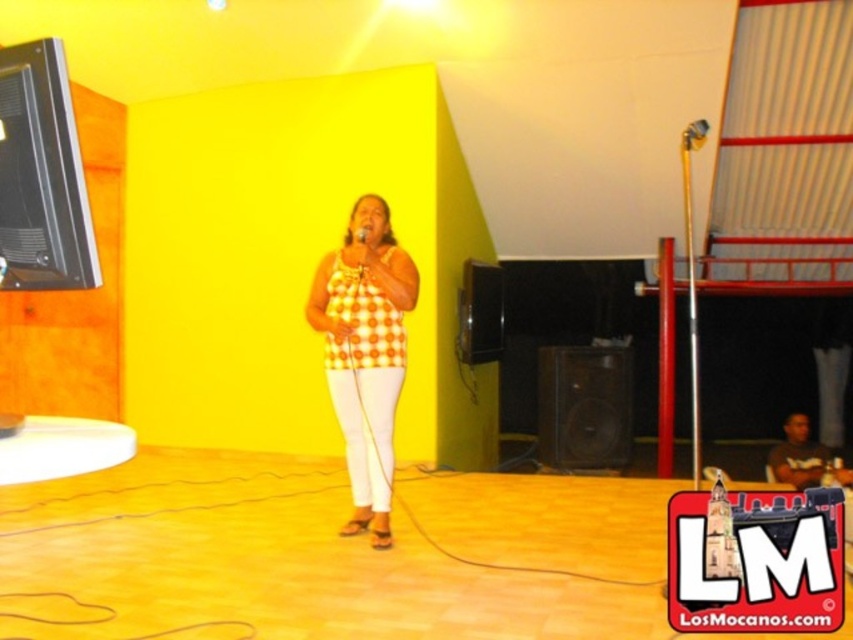
You are standing on the stage and want to move from the point at coordinates (358, 396) to the point at (370, 228). Can you walk directly towards the second point without going around?

Point (358, 396) is behind point (370, 228), so you cannot walk directly towards the second point without going around because you would have to move forward past the first point to reach the second.

You are a stagehand setting up for a performance. You need to place a new speaker to the right of the metallic shiny microphone at center. Based on the current setup, where should you position the speaker relative to the yellow checkered tank top at center?

The yellow checkered tank top at center is to the left of the metallic shiny microphone at center. Therefore, placing the speaker to the right of the metallic shiny microphone at center would position it to the right of the yellow checkered tank top at center as well.

You are a stagehand setting up for a performance. You need to ensure that the yellow checkered tank top at center and the metallic shiny microphone at center are visible to the audience. Given their sizes, which one might require more strategic placement to avoid being obscured?

The yellow checkered tank top at center has a larger size compared to the metallic shiny microphone at center, so it might require more strategic placement to avoid being obscured.